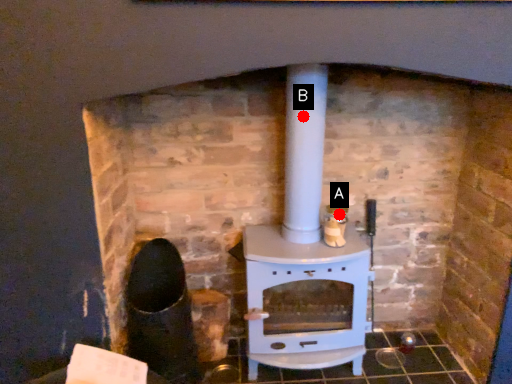
Question: Two points are circled on the image, labeled by A and B beside each circle. Which point is farther to the camera?

Choices:
 (A) A is further
 (B) B is further

Answer: (A)